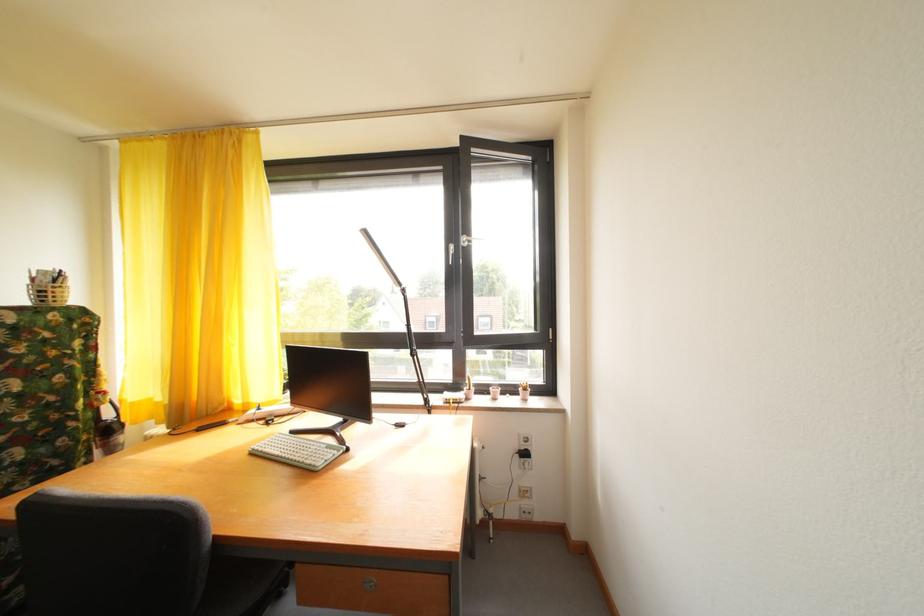
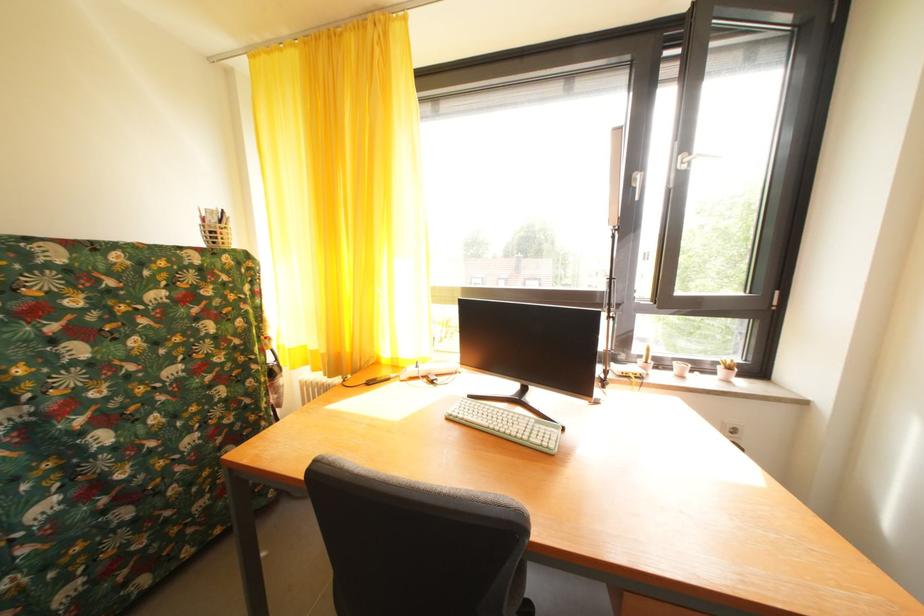
Locate, in the second image, the point that corresponds to (499,395) in the first image.

(685, 370)